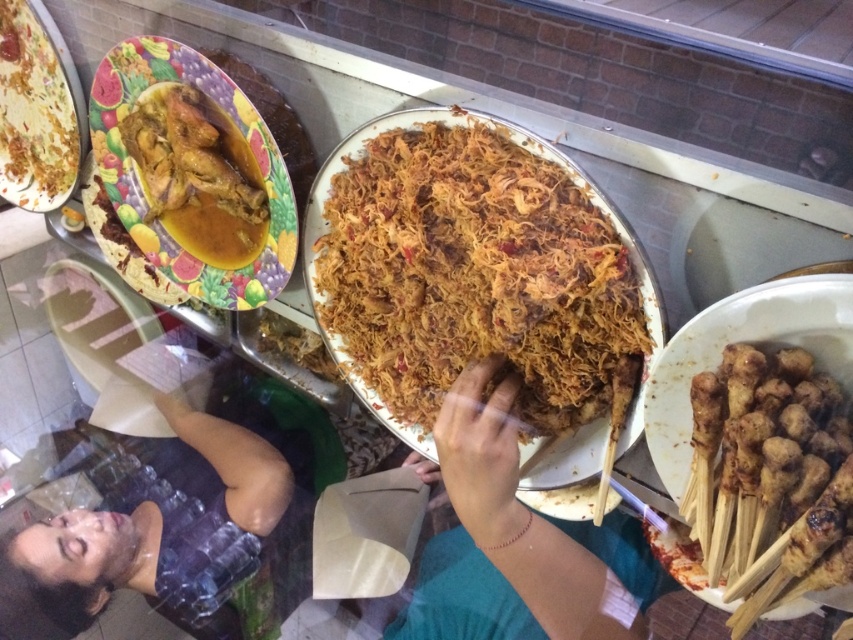
Question: Is brown matte noodles at center positioned at the back of yellow sauce with curry chicken at upper left?

Choices:
 (A) no
 (B) yes

Answer: (B)

Question: Which point is closer to the camera?

Choices:
 (A) yellow sauce with curry chicken at upper left
 (B) brown crispy noodles at center

Answer: (B)

Question: Observing the image, what is the correct spatial positioning of brown crispy noodles at center in reference to smooth skin at lower left?

Choices:
 (A) below
 (B) above

Answer: (B)

Question: Which object is the closest to the brown crispy noodles at center?

Choices:
 (A) brown matte hand at center
 (B) matte yellow plate at upper left
 (C) brown matte skewers at lower right

Answer: (C)

Question: Based on their relative distances, which object is nearer to the brown crispy noodles at center?

Choices:
 (A) yellow sauce with curry chicken at upper left
 (B) smooth skin at lower left

Answer: (A)

Question: Can you confirm if brown matte skewers at lower right is bigger than yellow sauce with curry chicken at upper left?

Choices:
 (A) yes
 (B) no

Answer: (A)